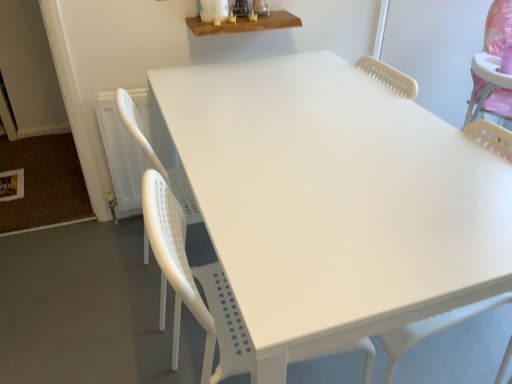
Question: Does white plastic table at center, the 1th table ordered from the bottom, appear on the left side of white plastic swivel chair at center?

Choices:
 (A) no
 (B) yes

Answer: (B)

Question: From a real-world perspective, is white plastic table at center, the second table in the top-to-bottom sequence, beneath white plastic swivel chair at center?

Choices:
 (A) no
 (B) yes

Answer: (B)

Question: Is white plastic table at center, the second table in the top-to-bottom sequence, next to white plastic swivel chair at center and touching it?

Choices:
 (A) yes
 (B) no

Answer: (B)

Question: Does white plastic table at center, the 1th table ordered from the bottom, turn towards white plastic swivel chair at center?

Choices:
 (A) no
 (B) yes

Answer: (A)

Question: Is white plastic table at center, the second table in the top-to-bottom sequence, smaller than white plastic swivel chair at center?

Choices:
 (A) no
 (B) yes

Answer: (B)

Question: In the image, is white plastic chair at center on the left side or the right side of wooden shelf at upper center, arranged as the 2th table when ordered from the bottom?

Choices:
 (A) left
 (B) right

Answer: (B)

Question: In the image, is white plastic chair at center positioned in front of or behind wooden shelf at upper center, arranged as the 2th table when ordered from the bottom?

Choices:
 (A) front
 (B) behind

Answer: (A)

Question: From a real-world perspective, is white plastic chair at center above or below wooden shelf at upper center, arranged as the 2th table when ordered from the bottom?

Choices:
 (A) below
 (B) above

Answer: (A)

Question: From the image's perspective, is white plastic chair at center positioned above or below wooden shelf at upper center, arranged as the 2th table when ordered from the bottom?

Choices:
 (A) below
 (B) above

Answer: (A)

Question: Considering the positions of white plastic swivel chair at center and wooden shelf at upper center, arranged as the 2th table when ordered from the bottom, in the image, is white plastic swivel chair at center taller or shorter than wooden shelf at upper center, arranged as the 2th table when ordered from the bottom,?

Choices:
 (A) short
 (B) tall

Answer: (B)

Question: Considering their positions, is white plastic swivel chair at center located in front of or behind wooden shelf at upper center, positioned as the first table in top-to-bottom order?

Choices:
 (A) front
 (B) behind

Answer: (A)

Question: Is white plastic swivel chair at center bigger or smaller than wooden shelf at upper center, arranged as the 2th table when ordered from the bottom?

Choices:
 (A) small
 (B) big

Answer: (B)

Question: Does point (467, 125) appear closer or farther from the camera than point (227, 24)?

Choices:
 (A) farther
 (B) closer

Answer: (B)

Question: Is white plastic chair at center wider or thinner than white plastic table at center, the second table in the top-to-bottom sequence?

Choices:
 (A) wide
 (B) thin

Answer: (B)

Question: Is white plastic chair at center spatially inside white plastic table at center, the 1th table ordered from the bottom, or outside of it?

Choices:
 (A) outside
 (B) inside

Answer: (A)